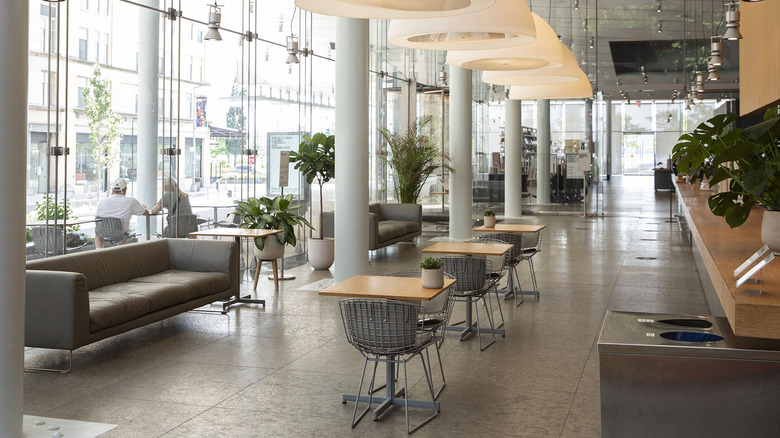
Locate an element on the screen. pillars is located at coordinates (353, 201), (458, 170), (519, 160), (546, 156), (589, 122), (146, 146).